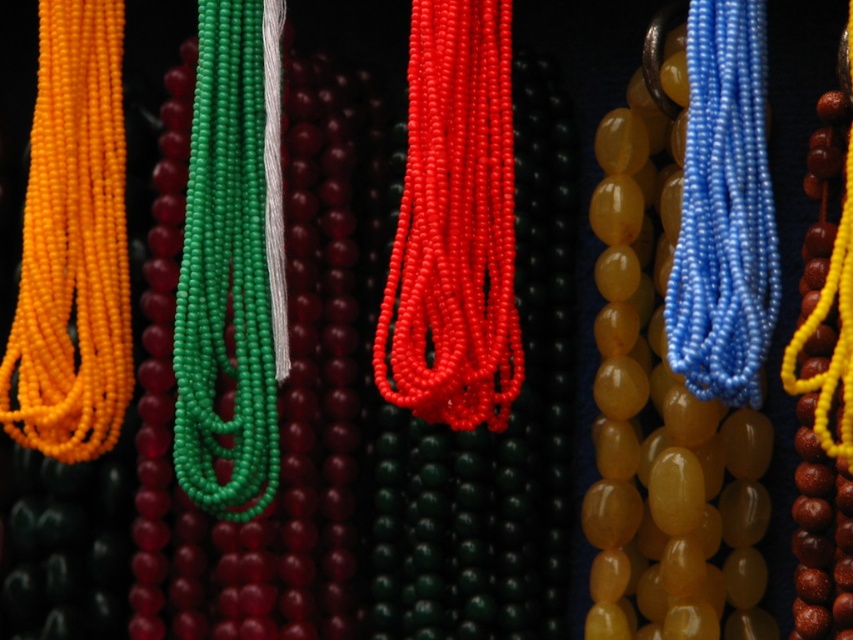
You are an interior designer arranging these necklaces on a wall. You want to place a new necklace between the shiny red beads at center and the matte yellow rope at left. Based on their positions, where should you place the new necklace?

Since the shiny red beads at center is above the matte yellow rope at left, you should place the new necklace between them by positioning it below the shiny red beads at center and above the matte yellow rope at left.